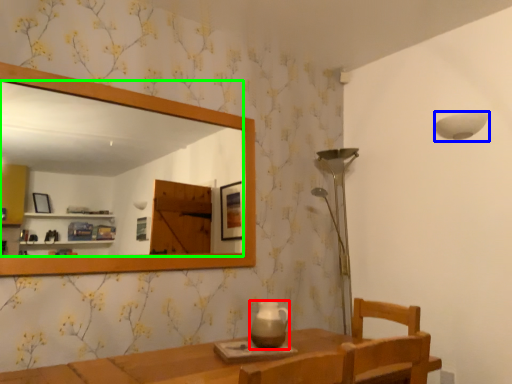
Question: Which object is positioned closest to tea pot (highlighted by a red box)? Select from lamp (highlighted by a blue box) and mirror (highlighted by a green box).

Choices:
 (A) lamp
 (B) mirror

Answer: (A)